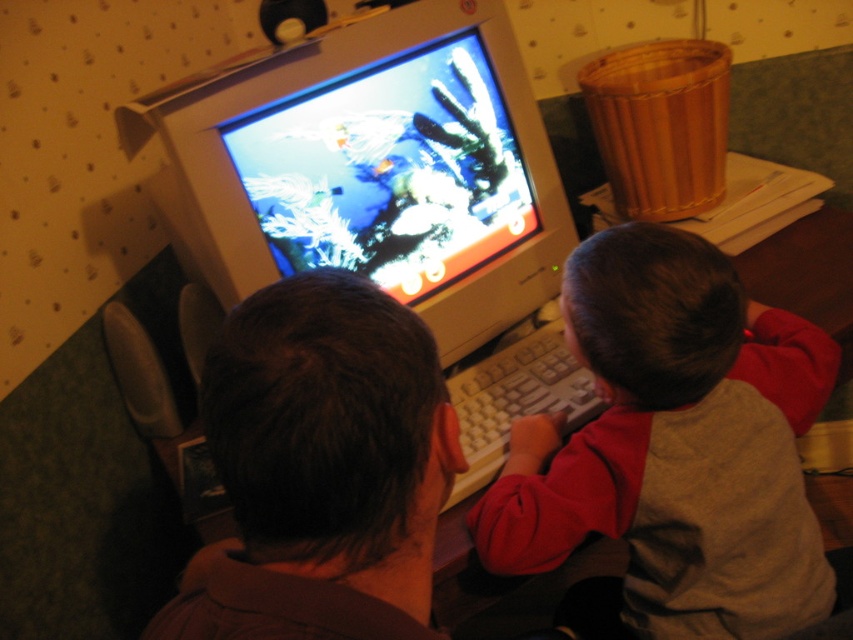
Who is higher up, shiny plastic monitor at center or gray cotton shirt at center?

shiny plastic monitor at center is higher up.

Which of these two, shiny plastic monitor at center or gray cotton shirt at center, stands taller?

gray cotton shirt at center is taller.

Where is `shiny plastic monitor at center`? shiny plastic monitor at center is located at coordinates (376, 168).

Find the location of a particular element. The image size is (853, 640). shiny plastic monitor at center is located at coordinates click(x=376, y=168).

Can you confirm if gray cotton shirt at center is bigger than brown matte hair at center?

Indeed, gray cotton shirt at center has a larger size compared to brown matte hair at center.

Does gray cotton shirt at center have a greater height compared to brown matte hair at center?

Indeed, gray cotton shirt at center has a greater height compared to brown matte hair at center.

Between point (596, 275) and point (349, 480), which one is positioned in front?

Point (349, 480)

Find the location of a particular element. Image resolution: width=853 pixels, height=640 pixels. gray cotton shirt at center is located at coordinates (675, 445).

Who is positioned more to the left, shiny plastic monitor at center or brown matte hair at center?

shiny plastic monitor at center is more to the left.

Who is more forward, (521, 65) or (403, 404)?

Point (403, 404) is in front.

Measure the distance between point (463, 308) and camera.

Point (463, 308) is 3.57 feet away from camera.

Identify the location of shiny plastic monitor at center. (376, 168).